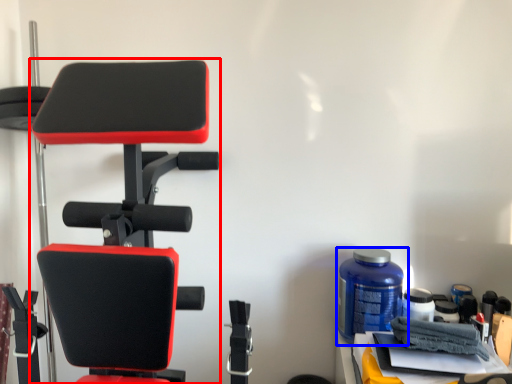
Question: Which point is further to the camera, chair (highlighted by a red box) or bottle (highlighted by a blue box)?

Choices:
 (A) chair
 (B) bottle

Answer: (B)